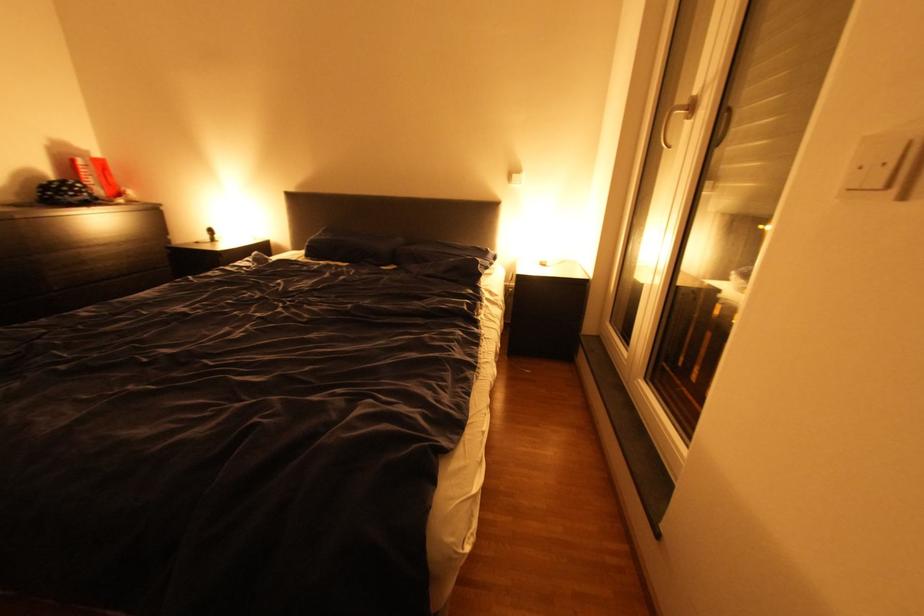
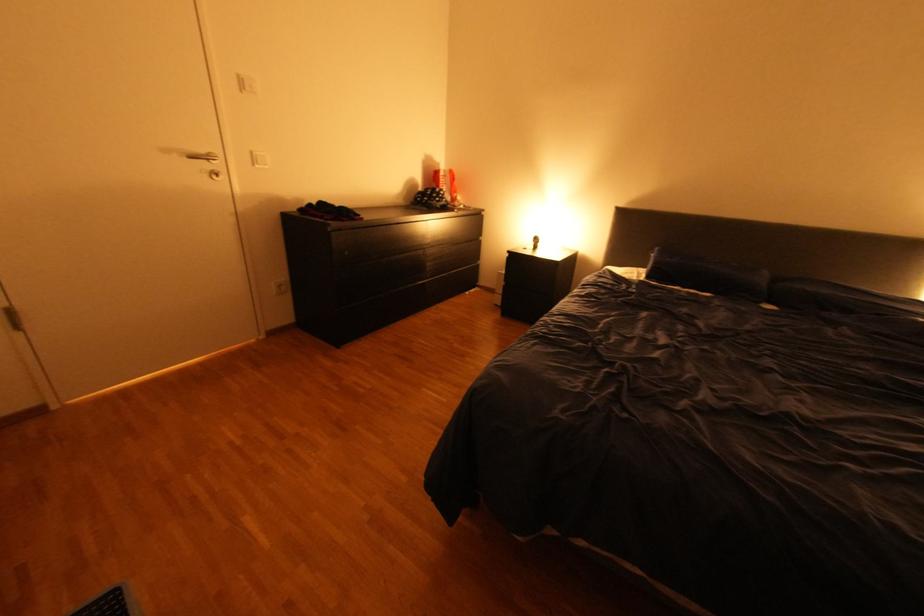
Locate, in the second image, the point that corresponds to point (92, 190) in the first image.

(454, 196)